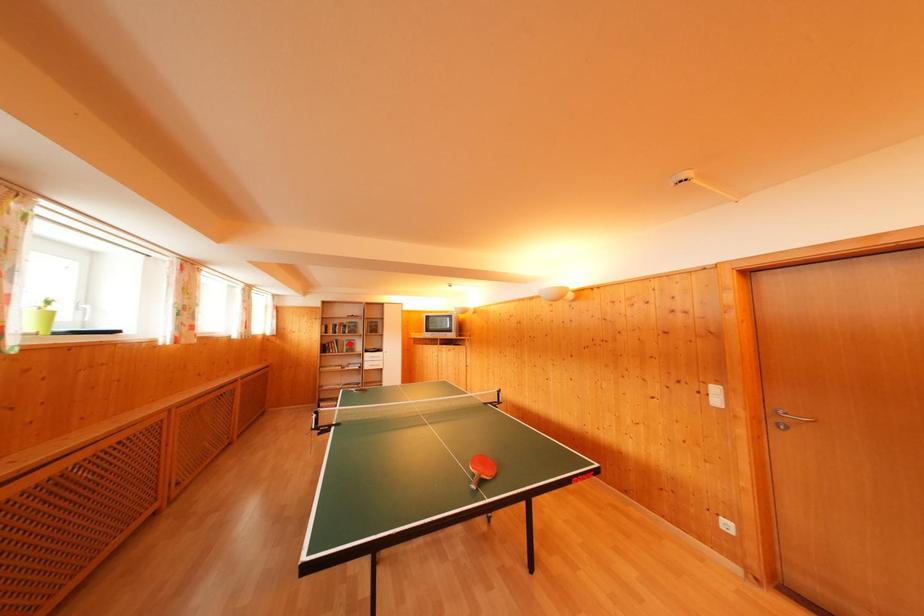
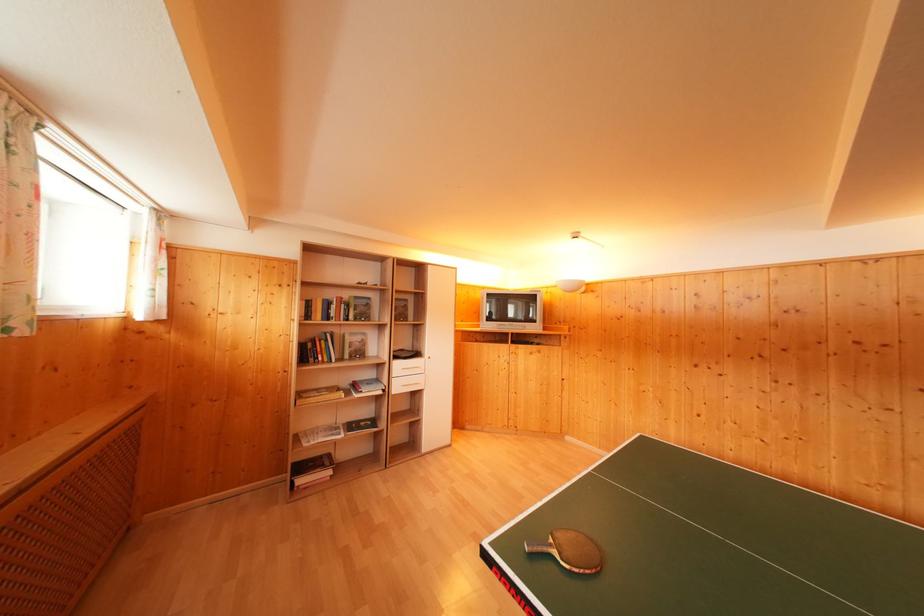
The point at the highlighted location is marked in the first image. Where is the corresponding point in the second image?

(350, 336)